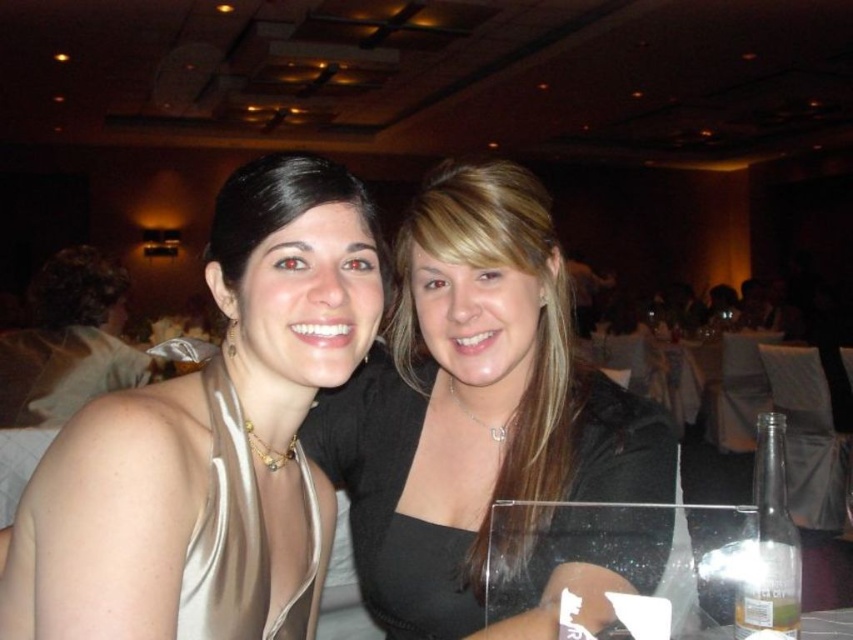
Locate an element on the screen. This screenshot has height=640, width=853. satin scarf at center is located at coordinates (212, 440).

Consider the image. Between satin scarf at center and satin dress at center, which one is positioned higher?

satin dress at center is above.

Is point (19, 532) closer to camera compared to point (321, 438)?

Yes, point (19, 532) is in front of point (321, 438).

Where is `satin scarf at center`? The height and width of the screenshot is (640, 853). satin scarf at center is located at coordinates (212, 440).

Can you confirm if satin scarf at center is shorter than black satin blouse at center?

Incorrect, satin scarf at center's height does not fall short of black satin blouse at center's.

Is satin scarf at center above black satin blouse at center?

Incorrect, satin scarf at center is not positioned above black satin blouse at center.

The width and height of the screenshot is (853, 640). What do you see at coordinates (212, 440) in the screenshot?
I see `satin scarf at center` at bounding box center [212, 440].

At what (x,y) coordinates should I click in order to perform the action: click on satin scarf at center. Please return your answer as a coordinate pair (x, y). This screenshot has height=640, width=853. Looking at the image, I should click on (212, 440).

Does satin dress at center have a greater width compared to black satin blouse at center?

Correct, the width of satin dress at center exceeds that of black satin blouse at center.

Can you confirm if satin dress at center is positioned below black satin blouse at center?

Correct, satin dress at center is located below black satin blouse at center.

Where is `satin dress at center`? satin dress at center is located at coordinates (474, 408).

You are a GUI agent. You are given a task and a screenshot of the screen. Output one action in this format:
    pyautogui.click(x=<x>, y=<y>)
    Task: Click on the satin dress at center
    Image resolution: width=853 pixels, height=640 pixels.
    Given the screenshot: What is the action you would take?
    pyautogui.click(x=474, y=408)